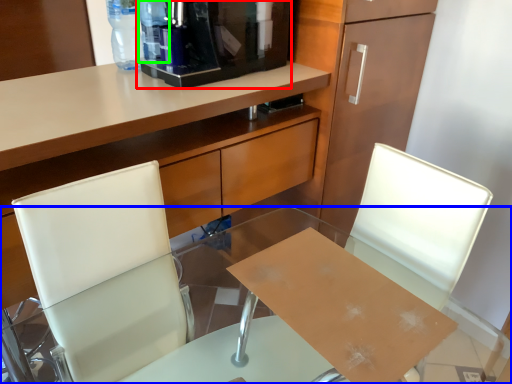
Question: Which is farther away from coffee machine (highlighted by a red box)? desk (highlighted by a blue box) or bottle (highlighted by a green box)?

Choices:
 (A) desk
 (B) bottle

Answer: (A)